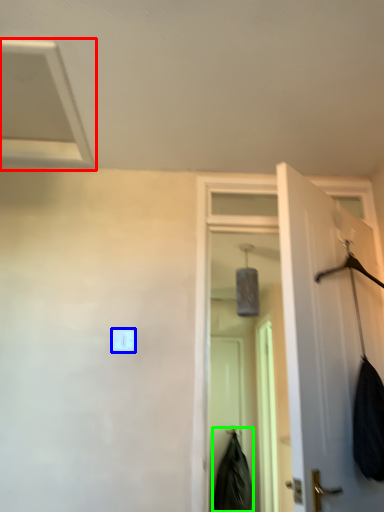
Question: Estimate the real-world distances between objects in this image. Which object is farther from exhaust hood (highlighted by a red box), light switch (highlighted by a blue box) or clothing (highlighted by a green box)?

Choices:
 (A) light switch
 (B) clothing

Answer: (B)